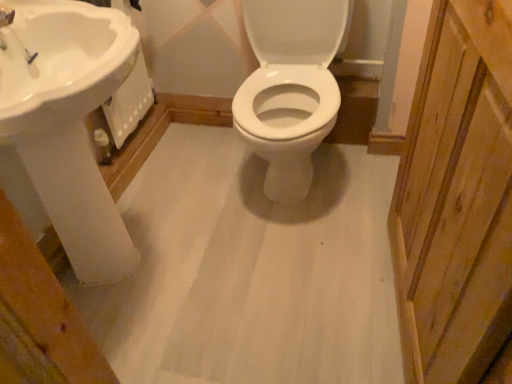
Question: Is natural wood screen door at right inside or outside of white glossy sink at upper left?

Choices:
 (A) outside
 (B) inside

Answer: (A)

Question: Does point (439, 152) appear closer or farther from the camera than point (80, 263)?

Choices:
 (A) closer
 (B) farther

Answer: (A)

Question: Is natural wood screen door at right wider or thinner than white glossy sink at upper left?

Choices:
 (A) wide
 (B) thin

Answer: (B)

Question: Is white glossy sink at upper left taller or shorter than natural wood screen door at right?

Choices:
 (A) short
 (B) tall

Answer: (A)

Question: From a real-world perspective, is white glossy sink at upper left positioned above or below natural wood screen door at right?

Choices:
 (A) below
 (B) above

Answer: (A)

Question: Relative to natural wood screen door at right, is white glossy sink at upper left in front or behind?

Choices:
 (A) front
 (B) behind

Answer: (B)

Question: Is point (60, 66) closer or farther from the camera than point (417, 195)?

Choices:
 (A) farther
 (B) closer

Answer: (A)